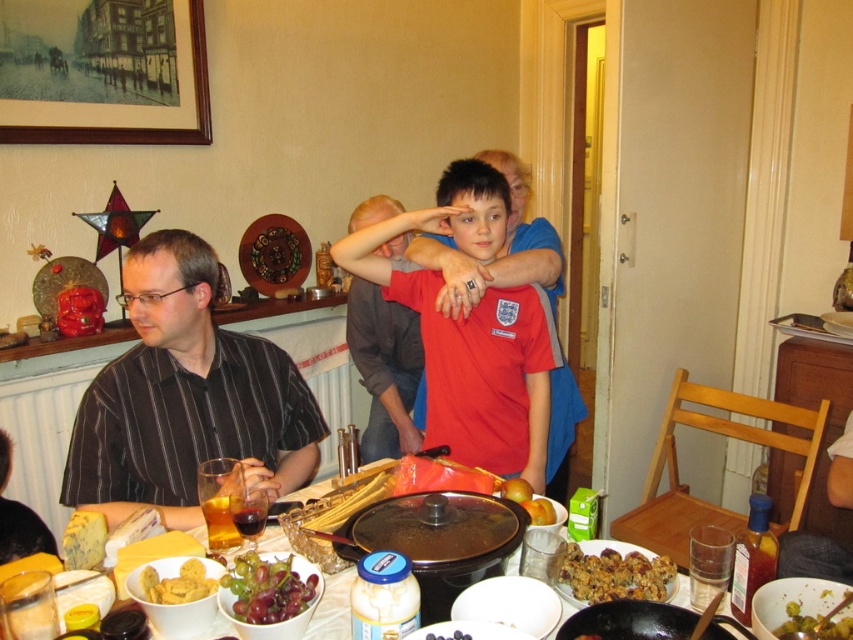
Question: Can you confirm if wooden picture frame at upper left is positioned below green glossy olives at center?

Choices:
 (A) no
 (B) yes

Answer: (A)

Question: Which object is positioned closest to the wooden picture frame at upper left?

Choices:
 (A) yellow matte cookies at lower left
 (B) black striped shirt at left
 (C) green glossy olives at center
 (D) matte red shirt at center

Answer: (B)

Question: Does wooden picture frame at upper left have a smaller size compared to matte plastic bowl at center?

Choices:
 (A) no
 (B) yes

Answer: (A)

Question: Among these points, which one is farthest from the camera?

Choices:
 (A) (550, 518)
 (B) (193, 600)

Answer: (A)

Question: Which point is closer to the camera?

Choices:
 (A) (193, 564)
 (B) (235, 632)
 (C) (165, 380)

Answer: (B)

Question: Can you confirm if wooden picture frame at upper left is wider than green matte grapes at lower center?

Choices:
 (A) no
 (B) yes

Answer: (B)